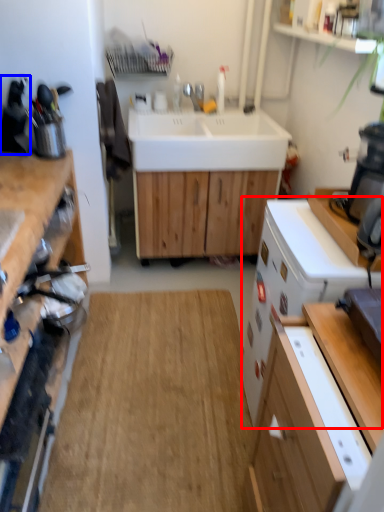
Question: Among these objects, which one is farthest to the camera, dish washer (highlighted by a red box) or appliance (highlighted by a blue box)?

Choices:
 (A) dish washer
 (B) appliance

Answer: (B)